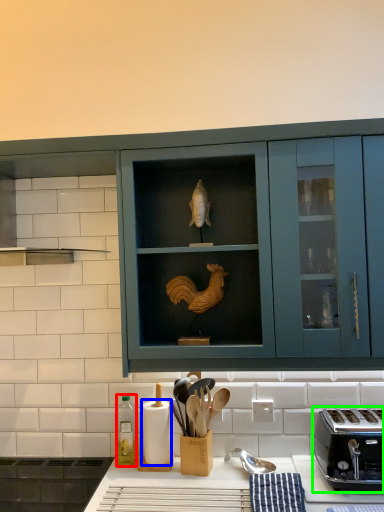
Question: Based on their relative distances, which object is nearer to bottle (highlighted by a red box)? Choose from paper towel (highlighted by a blue box) and toaster (highlighted by a green box).

Choices:
 (A) paper towel
 (B) toaster

Answer: (A)